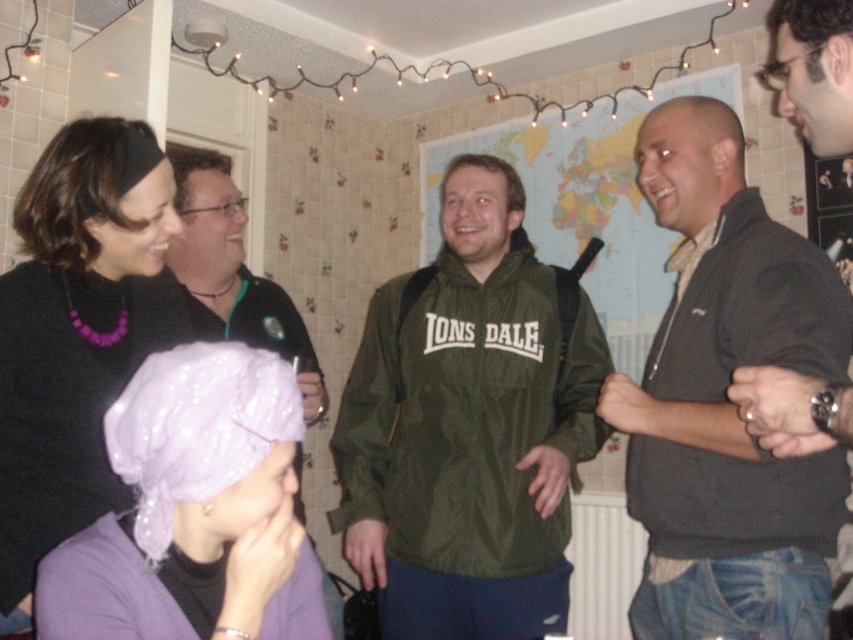
Which is more to the left, dark gray sweater at center or black matte jacket at upper left?

black matte jacket at upper left is more to the left.

Who is higher up, dark gray sweater at center or black matte jacket at upper left?

black matte jacket at upper left is above.

Is point (836, 502) farther from viewer compared to point (225, 209)?

That is False.

Find the location of a particular element. dark gray sweater at center is located at coordinates (726, 397).

Does olive green nylon jacket at center lie in front of black matte sweater at upper left?

No, it is behind black matte sweater at upper left.

Describe the element at coordinates (469, 426) in the screenshot. Image resolution: width=853 pixels, height=640 pixels. I see `olive green nylon jacket at center` at that location.

Find the location of a particular element. The width and height of the screenshot is (853, 640). olive green nylon jacket at center is located at coordinates (469, 426).

Can you confirm if black matte sweater at upper left is bigger than black matte jacket at upper left?

Incorrect, black matte sweater at upper left is not larger than black matte jacket at upper left.

Does black matte sweater at upper left appear over black matte jacket at upper left?

Incorrect, black matte sweater at upper left is not positioned above black matte jacket at upper left.

Find the location of `black matte sweater at upper left`. black matte sweater at upper left is located at coordinates (76, 333).